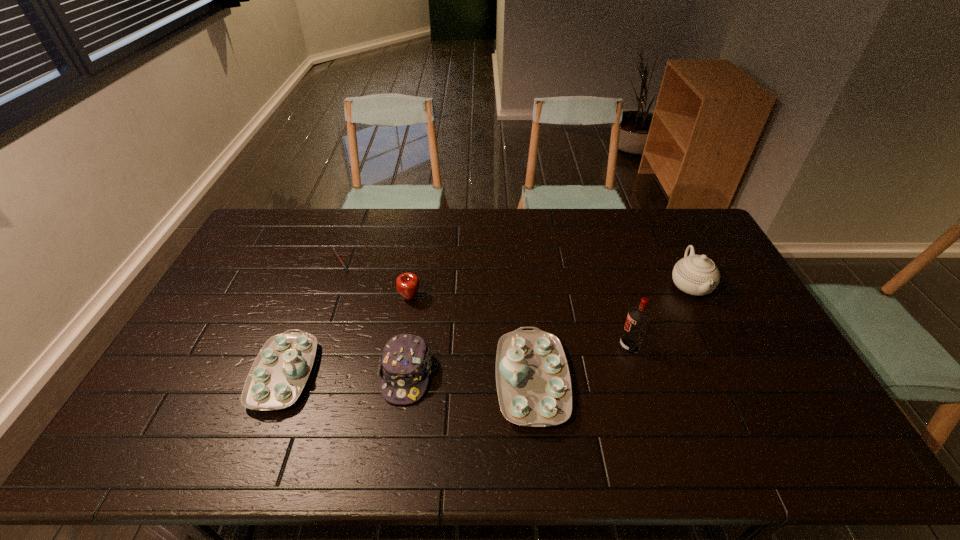
In the image, there is a desktop. Where is `vacant space at the near edge`? This screenshot has width=960, height=540. vacant space at the near edge is located at coordinates (459, 396).

In the image, there is a desktop. Identify the location of free space at the left edge. click(213, 294).

Where is `vacant space at the far left corner of the desktop`? The width and height of the screenshot is (960, 540). vacant space at the far left corner of the desktop is located at coordinates (264, 226).

This screenshot has width=960, height=540. What are the coordinates of `vacant space at the far right corner` in the screenshot? It's located at (708, 239).

Find the location of a particular element. vacant area that lies between the leftmost chinaware and the apple is located at coordinates (347, 336).

The width and height of the screenshot is (960, 540). I want to click on vacant area that lies between the second chinaware from right to left and the apple, so click(x=470, y=339).

Locate an element on the screen. free space between the second object from right to left and the farthest chinaware is located at coordinates (660, 316).

Find the location of a particular element. The height and width of the screenshot is (540, 960). free spot between the headwear and the farthest chinaware is located at coordinates (548, 330).

I want to click on unoccupied position between the leftmost chinaware and the rightmost object, so click(487, 330).

Identify the location of free space between the farthest chinaware and the leftmost chinaware. Image resolution: width=960 pixels, height=540 pixels. (487, 330).